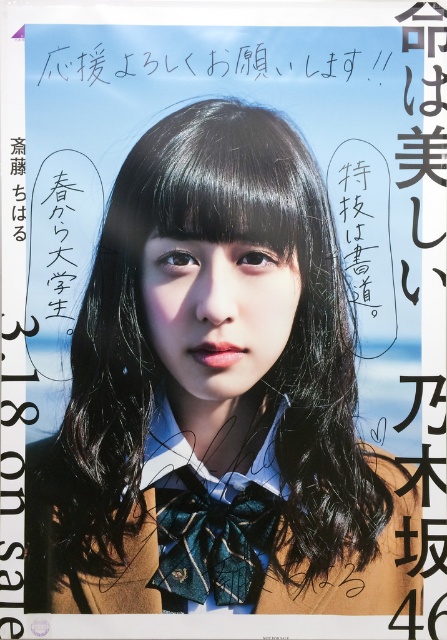
Question: Estimate the real-world distances between objects in this image. Which object is closer to the matte brown school uniform at center?

Choices:
 (A) teal textured tie at center
 (B) white handwritten text at upper center

Answer: (A)

Question: Observing the image, what is the correct spatial positioning of teal textured tie at center in reference to white handwritten text at upper center?

Choices:
 (A) above
 (B) below

Answer: (B)

Question: Does teal textured tie at center have a smaller size compared to white handwritten text at upper center?

Choices:
 (A) no
 (B) yes

Answer: (A)

Question: Does matte brown school uniform at center have a smaller size compared to white handwritten text at upper center?

Choices:
 (A) yes
 (B) no

Answer: (B)

Question: Among these objects, which one is nearest to the camera?

Choices:
 (A) matte brown school uniform at center
 (B) white handwritten text at upper center

Answer: (A)

Question: Which point is closer to the camera?

Choices:
 (A) matte brown school uniform at center
 (B) matte black face at center
 (C) white handwritten text at upper center
 (D) teal textured tie at center

Answer: (A)